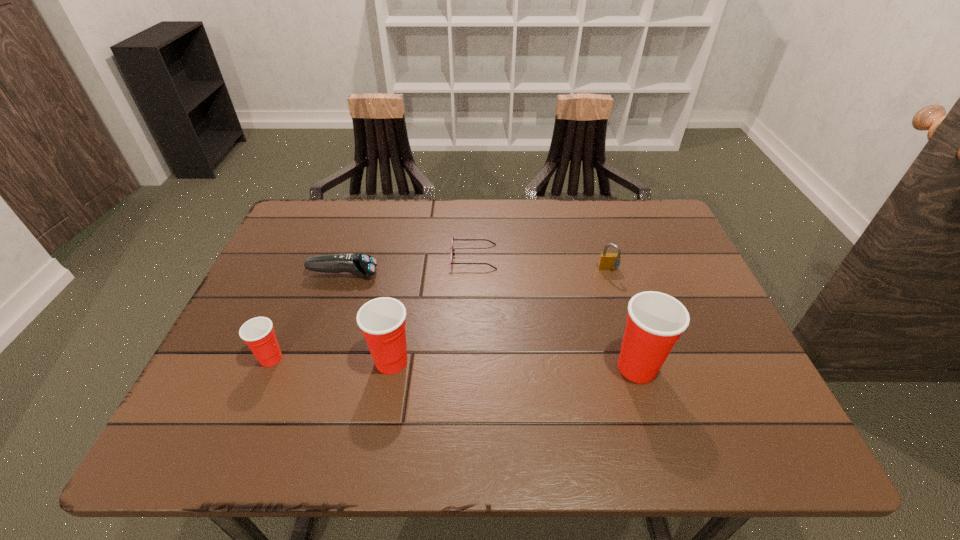
To make them evenly spaced by inserting another Dixie_cup among them, please locate a free space for this new Dixie_cup. Please provide its 2D coordinates. Your answer should be formatted as a tuple, i.e. [(x, y)], where the tuple contains the x and y coordinates of a point satisfying the conditions above.

[(514, 364)]